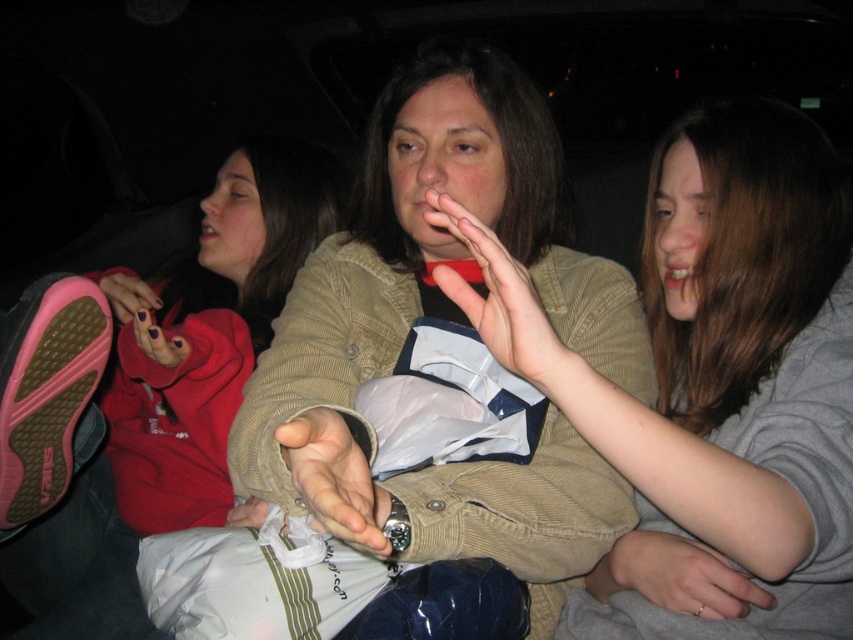
Question: Based on their relative distances, which object is nearer to the smooth beige hand at center?

Choices:
 (A) matte beige hand at center
 (B) dark purple nail polish at lower left
 (C) silver metallic ring at lower right
 (D) matte pink shoe at left

Answer: (A)

Question: Which of the following is the closest to the observer?

Choices:
 (A) matte pink shoe at left
 (B) matte beige sweater at center

Answer: (B)

Question: Does silver metallic ring at lower right appear on the right side of pink fabric at lower left?

Choices:
 (A) no
 (B) yes

Answer: (B)

Question: Which of the following is the closest to the observer?

Choices:
 (A) pink fabric at lower left
 (B) matte beige sweater at center
 (C) smooth beige hand at center

Answer: (C)

Question: Does matte beige sweater at center have a lesser width compared to smooth beige hand at center?

Choices:
 (A) no
 (B) yes

Answer: (A)

Question: Can you confirm if matte beige hand at center is thinner than silver metallic ring at lower right?

Choices:
 (A) no
 (B) yes

Answer: (B)